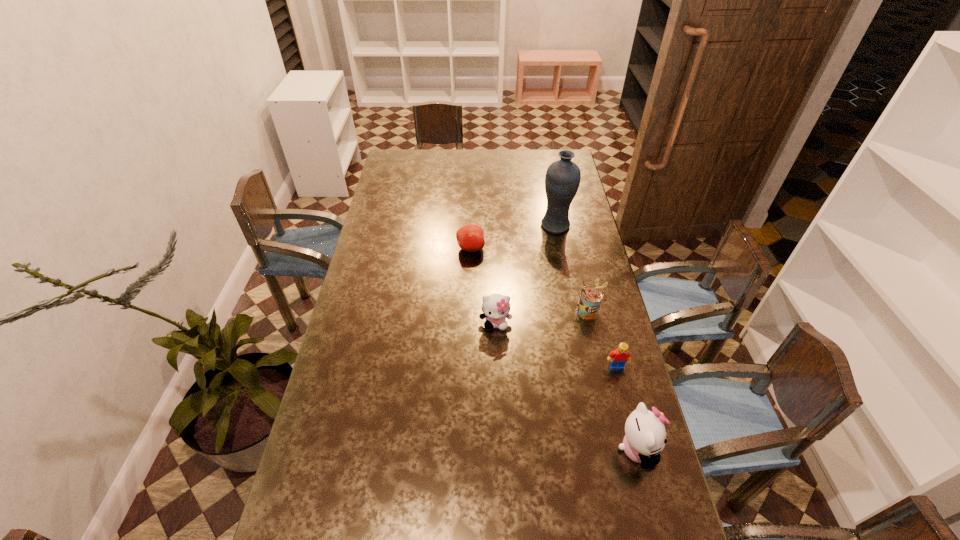
The height and width of the screenshot is (540, 960). In order to click on the left kitten in this screenshot , I will do `click(496, 307)`.

The height and width of the screenshot is (540, 960). I want to click on the shorter kitten, so click(496, 307).

Locate an element on the screen. the nearest object is located at coordinates (645, 437).

Locate an element on the screen. The width and height of the screenshot is (960, 540). the taller kitten is located at coordinates tap(645, 437).

The height and width of the screenshot is (540, 960). I want to click on can, so click(x=590, y=299).

Find the location of a particular element. This screenshot has width=960, height=540. apple is located at coordinates (470, 237).

This screenshot has height=540, width=960. I want to click on vase, so pyautogui.click(x=562, y=180).

This screenshot has width=960, height=540. Find the location of `the farthest object`. the farthest object is located at coordinates (562, 180).

Locate an element on the screen. Lego is located at coordinates (618, 358).

This screenshot has height=540, width=960. What are the coordinates of `free spot located on the front-facing side of the farther kitten` in the screenshot? It's located at (496, 357).